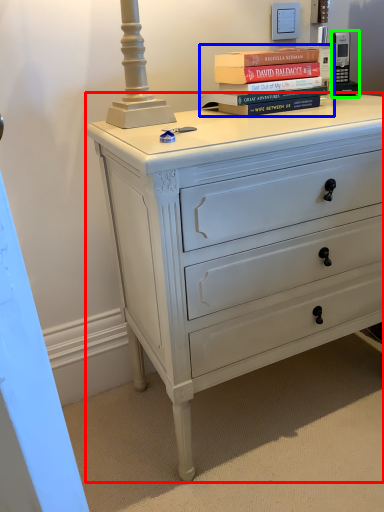
Question: Which object is positioned closest to chest of drawers (highlighted by a red box)? Select from book (highlighted by a blue box) and gadget (highlighted by a green box).

Choices:
 (A) book
 (B) gadget

Answer: (A)